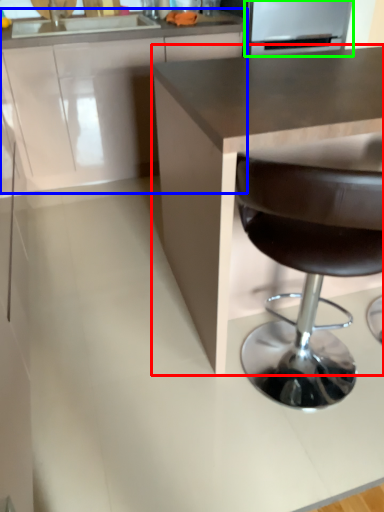
Question: Considering the real-world distances, which object is farthest from countertop (highlighted by a red box)? cabinetry (highlighted by a blue box) or appliance (highlighted by a green box)?

Choices:
 (A) cabinetry
 (B) appliance

Answer: (B)